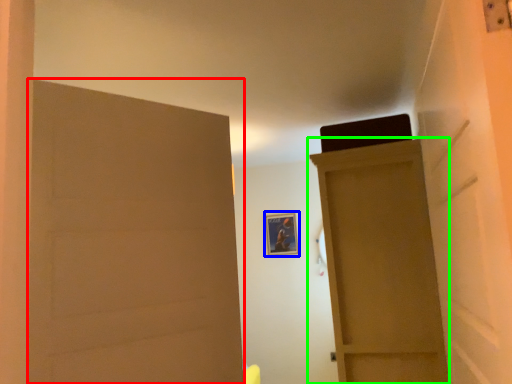
Question: Based on their relative distances, which object is nearer to door (highlighted by a red box)? Choose from picture frame (highlighted by a blue box) and door (highlighted by a green box).

Choices:
 (A) picture frame
 (B) door

Answer: (B)